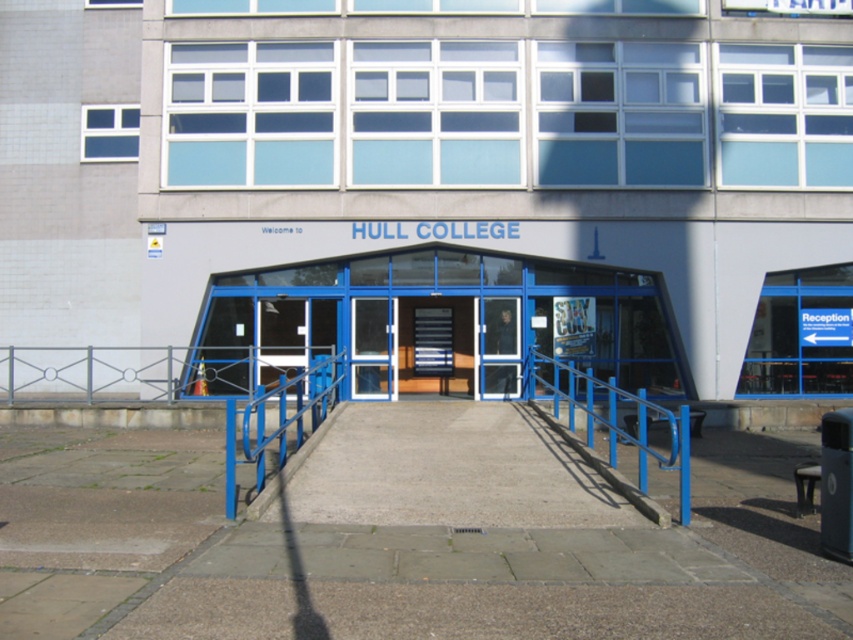
You are a maintenance worker needing to reach the blue metallic handrail at center and the wooden staircase at center. Your ladder is 5 meters long. Can you safely reach both objects with the ladder?

The blue metallic handrail at center is 5.18 meters away from wooden staircase at center. Since the ladder is only 5 meters long, it is too short to bridge the distance between them. Therefore, you cannot safely reach both objects with the ladder.

You are a maintenance worker needing to replace the handrail. The wooden staircase at center is 1.2 meters wide. What is the minimum width you should order for the new blue metallic handrail at center?

The blue metallic handrail at center is wider than the wooden staircase at center, which is 1.2 meters wide. Therefore, the minimum width for the new handrail should be greater than 1.2 meters.